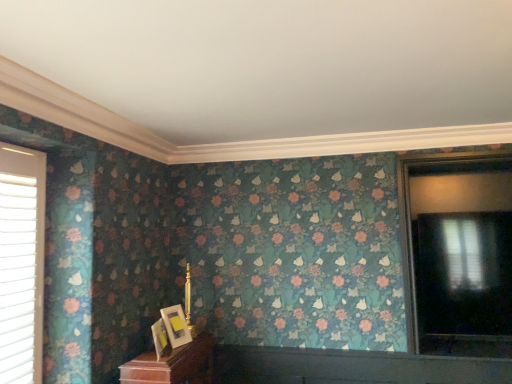
Measure the distance between point (468, 186) and camera.

They are 9.31 feet apart.

What do you see at coordinates (176, 326) in the screenshot? This screenshot has height=384, width=512. I see `matte gold picture frame at lower center, which is the 1th picture frame from back to front` at bounding box center [176, 326].

How much space does matte gold picture frame at lower center, the 2th picture frame in the front-to-back sequence, occupy horizontally?

The width of matte gold picture frame at lower center, the 2th picture frame in the front-to-back sequence, is 4.57 inches.

This screenshot has height=384, width=512. What do you see at coordinates (21, 263) in the screenshot?
I see `white plastic blinds at left, which is the 2th window in back-to-front order` at bounding box center [21, 263].

This screenshot has height=384, width=512. In order to click on white plastic blinds at left, which ranks as the 2th window in right-to-left order in this screenshot , I will do `click(21, 263)`.

The width and height of the screenshot is (512, 384). In order to click on matte black window at right, which ranks as the 1th window in back-to-front order in this screenshot , I will do `click(458, 252)`.

Which object is positioned more to the left, matte black window at right, which ranks as the first window in right-to-left order, or matte gold picture frame at lower center, which is the 1th picture frame from back to front?

matte gold picture frame at lower center, which is the 1th picture frame from back to front.

Which is less distant, (x=438, y=321) or (x=169, y=337)?

Clearly, point (x=438, y=321) is more distant from the camera than point (x=169, y=337).

Is matte black window at right, the second window viewed from the left, placed right next to matte gold picture frame at lower center, which is the 1th picture frame from back to front?

matte black window at right, the second window viewed from the left, and matte gold picture frame at lower center, which is the 1th picture frame from back to front, are not in contact.

Which object is further away from the camera, matte black window at right, which is the second window from front to back, or matte gold picture frame at lower center, which is the 1th picture frame from back to front?

matte black window at right, which is the second window from front to back, is further away from the camera.

Is matte gold picture frame at lower center, the 2th picture frame viewed from the back, at the back of matte black window at right, the second window viewed from the left?

matte black window at right, the second window viewed from the left, does not have its back to matte gold picture frame at lower center, the 2th picture frame viewed from the back.

From the image's perspective, is matte black window at right, which is the second window from front to back, located beneath matte gold picture frame at lower center, which is the 1th picture frame in front-to-back order?

No, from the image's perspective, matte black window at right, which is the second window from front to back, is not below matte gold picture frame at lower center, which is the 1th picture frame in front-to-back order.

Is matte black window at right, the second window viewed from the left, behind matte gold picture frame at lower center, which is the 1th picture frame in front-to-back order?

Yes.

Could you measure the distance between matte gold picture frame at lower center, the 2th picture frame in the front-to-back sequence, and matte gold picture frame at lower center, which is the 1th picture frame in front-to-back order?

matte gold picture frame at lower center, the 2th picture frame in the front-to-back sequence, is 3.50 inches from matte gold picture frame at lower center, which is the 1th picture frame in front-to-back order.

Can you tell me how much matte gold picture frame at lower center, which is the 1th picture frame from back to front, and matte gold picture frame at lower center, the 2th picture frame viewed from the back, differ in facing direction?

matte gold picture frame at lower center, which is the 1th picture frame from back to front, and matte gold picture frame at lower center, the 2th picture frame viewed from the back, are facing 27.2 degrees away from each other.

Can you confirm if matte gold picture frame at lower center, which is the 1th picture frame from back to front, is bigger than matte gold picture frame at lower center, the 2th picture frame viewed from the back?

Indeed, matte gold picture frame at lower center, which is the 1th picture frame from back to front, has a larger size compared to matte gold picture frame at lower center, the 2th picture frame viewed from the back.

Can you confirm if matte gold picture frame at lower center, which is the 1th picture frame from back to front, is taller than matte gold picture frame at lower center, the 2th picture frame viewed from the back?

Yes, matte gold picture frame at lower center, which is the 1th picture frame from back to front, is taller than matte gold picture frame at lower center, the 2th picture frame viewed from the back.

Can you tell me how much matte gold picture frame at lower center, the 2th picture frame in the front-to-back sequence, and white plastic blinds at left, the 1th window positioned from the left, differ in facing direction?

The angular difference between matte gold picture frame at lower center, the 2th picture frame in the front-to-back sequence, and white plastic blinds at left, the 1th window positioned from the left, is 16.3 degrees.

From their relative heights in the image, would you say matte gold picture frame at lower center, the 2th picture frame in the front-to-back sequence, is taller or shorter than white plastic blinds at left, which is the 2th window in back-to-front order?

In the image, matte gold picture frame at lower center, the 2th picture frame in the front-to-back sequence, appears to be shorter than white plastic blinds at left, which is the 2th window in back-to-front order.

Is matte gold picture frame at lower center, the 2th picture frame in the front-to-back sequence, positioned with its back to white plastic blinds at left, which is the 1th window in front-to-back order?

matte gold picture frame at lower center, the 2th picture frame in the front-to-back sequence, does not have its back to white plastic blinds at left, which is the 1th window in front-to-back order.

Considering the points (178, 341) and (10, 235), which point is in front, point (178, 341) or point (10, 235)?

The point (10, 235) is in front.

Is white plastic blinds at left, which is the 1th window in front-to-back order, wider than matte black window at right, which ranks as the first window in right-to-left order?

Yes.

Find the location of a particular element. This screenshot has height=384, width=512. window located below the matte black window at right, which ranks as the 1th window in back-to-front order (from the image's perspective) is located at coordinates (21, 263).

Is white plastic blinds at left, which ranks as the 2th window in right-to-left order, oriented away from matte black window at right, which is the second window from front to back?

No.

Between point (39, 349) and point (446, 340), which one is positioned behind?

Positioned behind is point (446, 340).

From a real-world perspective, which object stands above the other?

In real-world perspective, white plastic blinds at left, which is the 2th window in back-to-front order, is above.

Is white plastic blinds at left, the 1th window positioned from the left, touching matte gold picture frame at lower center, the 2th picture frame viewed from the back?

No, white plastic blinds at left, the 1th window positioned from the left, is not making contact with matte gold picture frame at lower center, the 2th picture frame viewed from the back.

Is matte gold picture frame at lower center, the 2th picture frame viewed from the back, a part of white plastic blinds at left, which ranks as the 2th window in right-to-left order?

No, matte gold picture frame at lower center, the 2th picture frame viewed from the back, is located outside of white plastic blinds at left, which ranks as the 2th window in right-to-left order.

What's the angular difference between matte gold picture frame at lower center, the 2th picture frame viewed from the back, and white plastic blinds at left, which ranks as the 2th window in right-to-left order,'s facing directions?

matte gold picture frame at lower center, the 2th picture frame viewed from the back, and white plastic blinds at left, which ranks as the 2th window in right-to-left order, are facing 10.9 degrees away from each other.

From the image's perspective, between matte gold picture frame at lower center, which is the 1th picture frame in front-to-back order, and white plastic blinds at left, which is the 1th window in front-to-back order, who is located below?

matte gold picture frame at lower center, which is the 1th picture frame in front-to-back order, from the image's perspective.

Where is `the 1st window above the matte gold picture frame at lower center, which is the 1th picture frame in front-to-back order (from the image's perspective)`? The width and height of the screenshot is (512, 384). the 1st window above the matte gold picture frame at lower center, which is the 1th picture frame in front-to-back order (from the image's perspective) is located at coordinates (21, 263).

From a real-world perspective, which window is the 2nd one above the matte gold picture frame at lower center, which is the 1th picture frame from back to front? Please provide its 2D coordinates.

[(458, 252)]

From a real-world perspective, starting from the matte black window at right, the second window viewed from the left, which picture frame is the 2nd one below it? Please provide its 2D coordinates.

[(160, 339)]

When comparing their distances from matte gold picture frame at lower center, the 2th picture frame viewed from the back, does matte gold picture frame at lower center, which is the 1th picture frame from back to front, or matte black window at right, the second window viewed from the left, seem closer?

matte gold picture frame at lower center, which is the 1th picture frame from back to front.

Which object lies nearer to the anchor point matte gold picture frame at lower center, the 2th picture frame in the front-to-back sequence, matte gold picture frame at lower center, the 2th picture frame viewed from the back, or matte black window at right, the second window viewed from the left?

Based on the image, matte gold picture frame at lower center, the 2th picture frame viewed from the back, appears to be nearer to matte gold picture frame at lower center, the 2th picture frame in the front-to-back sequence.

When comparing their distances from matte black window at right, which ranks as the 1th window in back-to-front order, does matte gold picture frame at lower center, the 2th picture frame in the front-to-back sequence, or white plastic blinds at left, the 1th window positioned from the left, seem closer?

matte gold picture frame at lower center, the 2th picture frame in the front-to-back sequence, is positioned closer to the anchor matte black window at right, which ranks as the 1th window in back-to-front order.

From the image, which object appears to be farther from white plastic blinds at left, the 1th window positioned from the left, matte gold picture frame at lower center, which is the 1th picture frame in front-to-back order, or matte black window at right, which ranks as the first window in right-to-left order?

The object further to white plastic blinds at left, the 1th window positioned from the left, is matte black window at right, which ranks as the first window in right-to-left order.

Estimate the real-world distances between objects in this image. Which object is closer to matte gold picture frame at lower center, which is the 1th picture frame in front-to-back order, white plastic blinds at left, the 1th window positioned from the left, or matte gold picture frame at lower center, which is the 1th picture frame from back to front?

The object closer to matte gold picture frame at lower center, which is the 1th picture frame in front-to-back order, is matte gold picture frame at lower center, which is the 1th picture frame from back to front.

Based on their spatial positions, is white plastic blinds at left, which ranks as the 2th window in right-to-left order, or matte gold picture frame at lower center, the 2th picture frame viewed from the back, closer to matte black window at right, which ranks as the first window in right-to-left order?

matte gold picture frame at lower center, the 2th picture frame viewed from the back, lies closer to matte black window at right, which ranks as the first window in right-to-left order, than the other object.

Considering their positions, is white plastic blinds at left, which ranks as the 2th window in right-to-left order, positioned further to matte gold picture frame at lower center, the 2th picture frame in the front-to-back sequence, than matte black window at right, which ranks as the 1th window in back-to-front order?

matte black window at right, which ranks as the 1th window in back-to-front order.

Considering their positions, is matte gold picture frame at lower center, the 2th picture frame viewed from the back, positioned closer to matte gold picture frame at lower center, the 2th picture frame in the front-to-back sequence, than white plastic blinds at left, the 1th window positioned from the left?

Among the two, matte gold picture frame at lower center, the 2th picture frame viewed from the back, is located nearer to matte gold picture frame at lower center, the 2th picture frame in the front-to-back sequence.

You are a GUI agent. You are given a task and a screenshot of the screen. Output one action in this format:
    pyautogui.click(x=<x>, y=<y>)
    Task: Click on the picture frame between white plastic blinds at left, which is the 1th window in front-to-back order, and matte gold picture frame at lower center, which is the 1th picture frame from back to front, in the horizontal direction
    This screenshot has height=384, width=512.
    Given the screenshot: What is the action you would take?
    pyautogui.click(x=160, y=339)

I want to click on picture frame between matte gold picture frame at lower center, the 2th picture frame viewed from the back, and matte black window at right, which ranks as the first window in right-to-left order, from left to right, so click(176, 326).